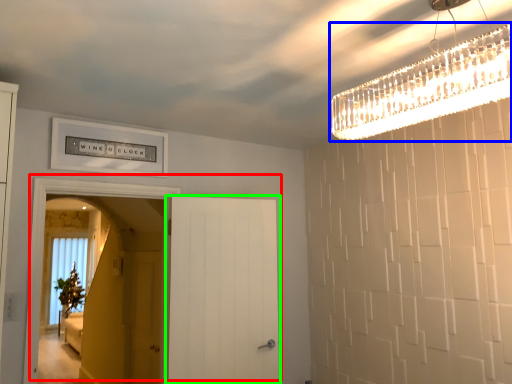
Question: Which is nearer to the door (highlighted by a red box)? light fixture (highlighted by a blue box) or door (highlighted by a green box).

Choices:
 (A) light fixture
 (B) door

Answer: (B)